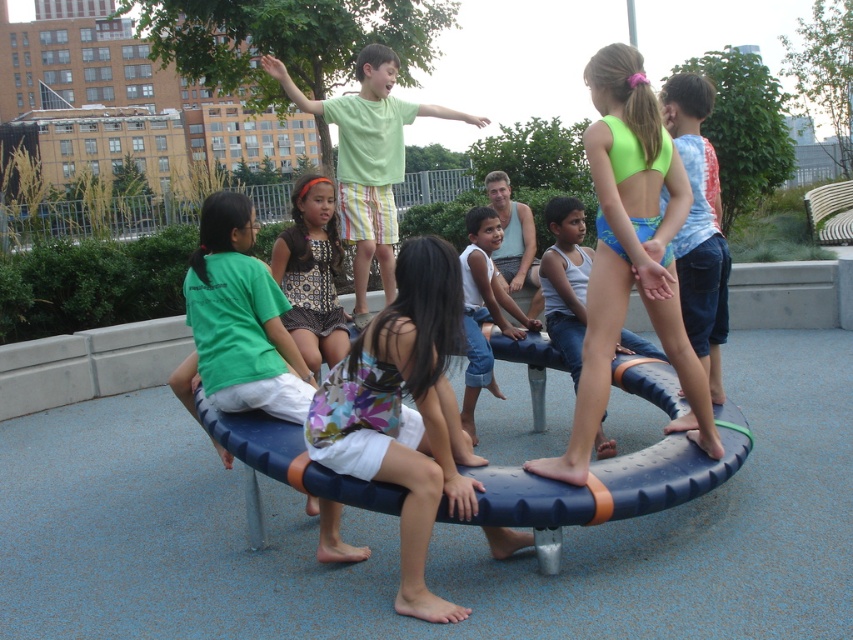
Does floral fabric dress at center appear under blue textured shorts at center?

Correct, floral fabric dress at center is located below blue textured shorts at center.

From the picture: Is floral fabric dress at center wider than blue textured shorts at center?

Correct, the width of floral fabric dress at center exceeds that of blue textured shorts at center.

Describe the element at coordinates (404, 412) in the screenshot. The height and width of the screenshot is (640, 853). I see `floral fabric dress at center` at that location.

The image size is (853, 640). I want to click on floral fabric dress at center, so click(404, 412).

Who is more distant from viewer, (305, 104) or (485, 376)?

The point (305, 104) is behind.

Identify the location of green matte shirt at upper center. This screenshot has height=640, width=853. (368, 156).

Does floral fabric dress at center have a larger size compared to dotted fabric dress at center?

Indeed, floral fabric dress at center has a larger size compared to dotted fabric dress at center.

Is floral fabric dress at center to the left of dotted fabric dress at center from the viewer's perspective?

Incorrect, floral fabric dress at center is not on the left side of dotted fabric dress at center.

Find the location of a particular element. This screenshot has width=853, height=640. floral fabric dress at center is located at coordinates (404, 412).

The image size is (853, 640). I want to click on floral fabric dress at center, so click(x=404, y=412).